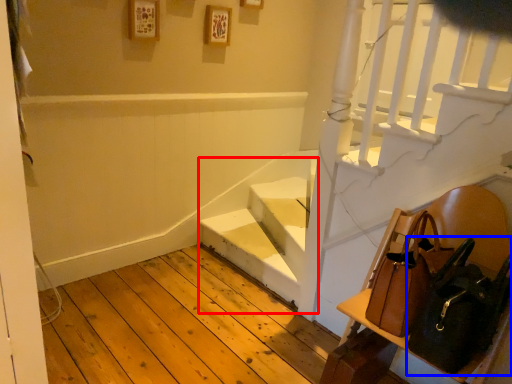
Question: Which object appears farthest to the camera in this image, stairwell (highlighted by a red box) or shoulder bag (highlighted by a blue box)?

Choices:
 (A) stairwell
 (B) shoulder bag

Answer: (A)